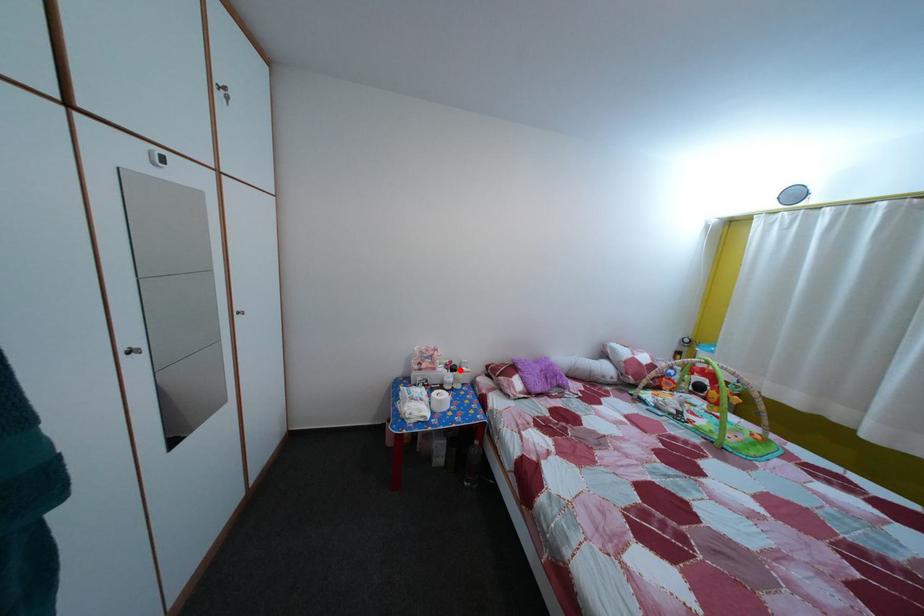
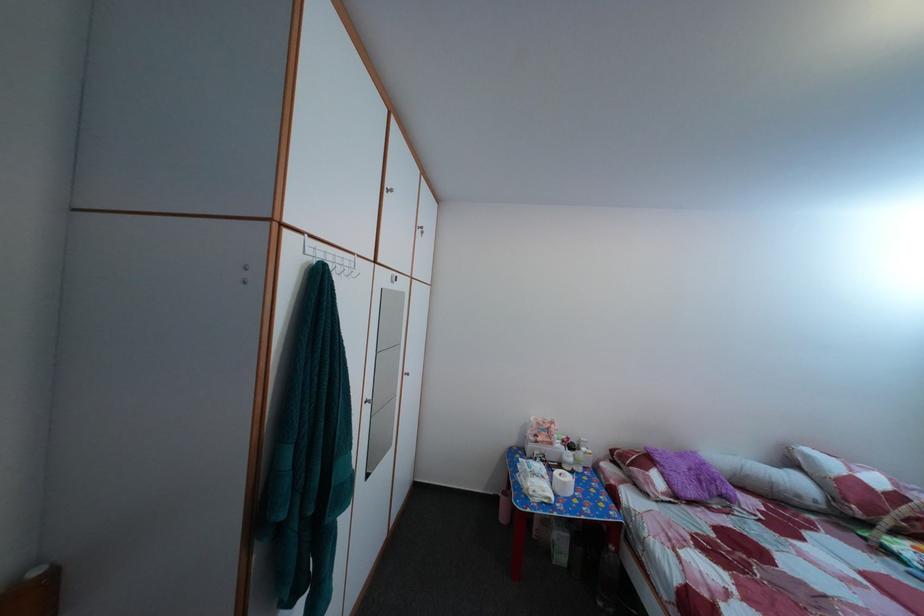
Find the pixel in the second image that matches the highlighted location in the first image.

(578, 447)